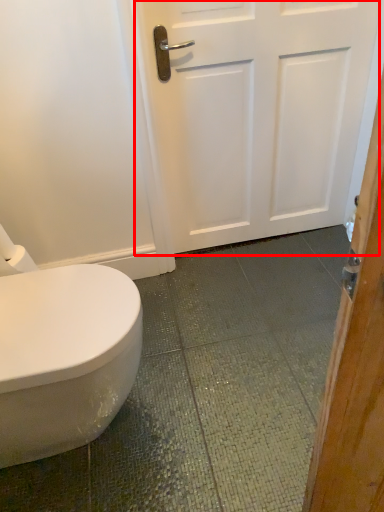
Question: In this image, where is door (annotated by the red box) located relative to toilet paper?

Choices:
 (A) left
 (B) right

Answer: (B)